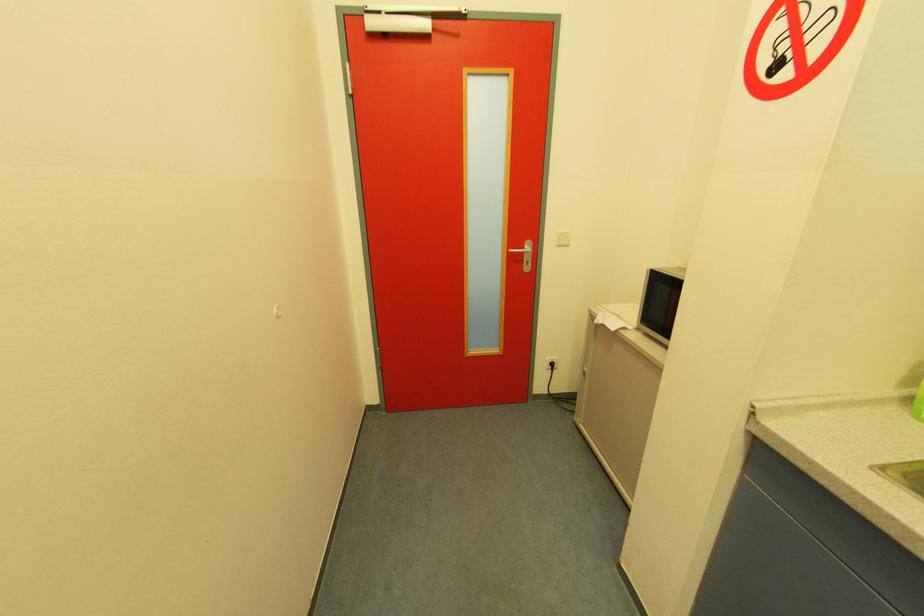
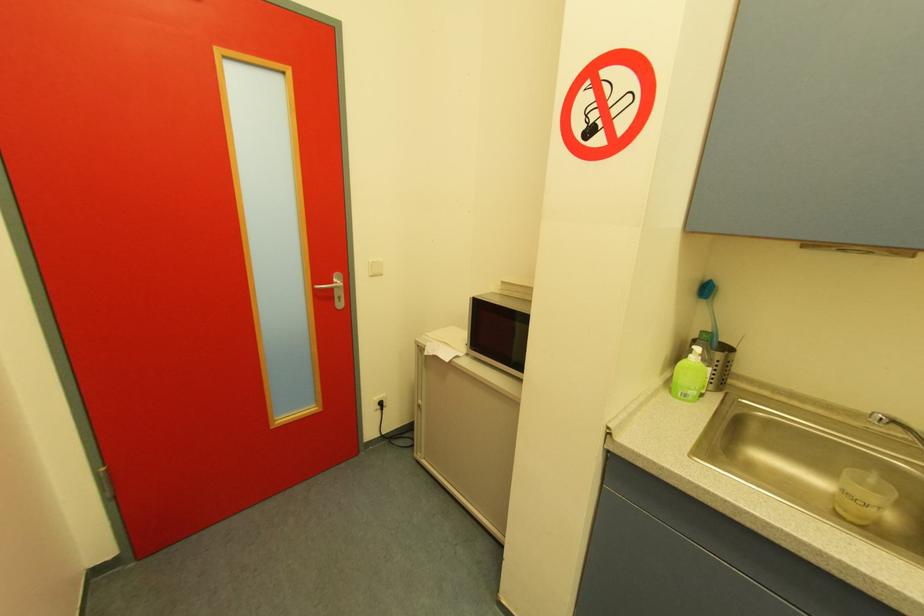
Question: The images are taken continuously from a first-person perspective. In which direction is your viewpoint rotating?

Choices:
 (A) Left
 (B) Right
 (C) Up
 (D) Down

Answer: (B)